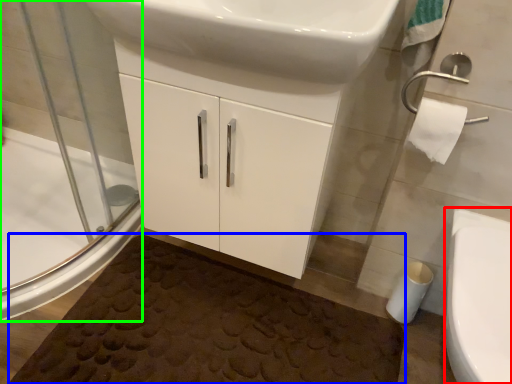
Question: Estimate the real-world distances between objects in this image. Which object is farther from bidet (highlighted by a red box), bath mat (highlighted by a blue box) or shower door (highlighted by a green box)?

Choices:
 (A) bath mat
 (B) shower door

Answer: (B)